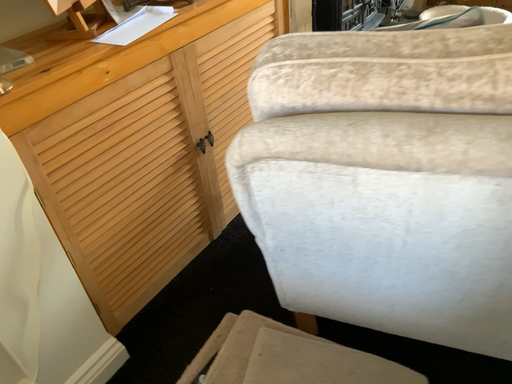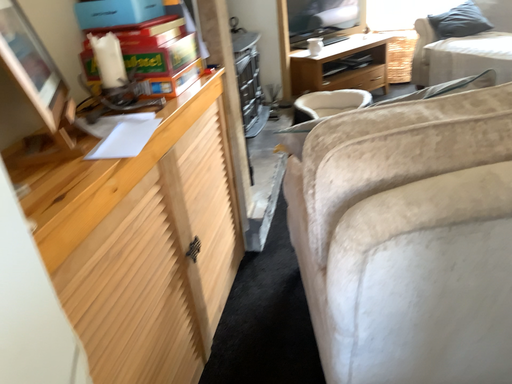
Question: How did the camera likely rotate when shooting the video?

Choices:
 (A) rotated right
 (B) rotated left

Answer: (A)